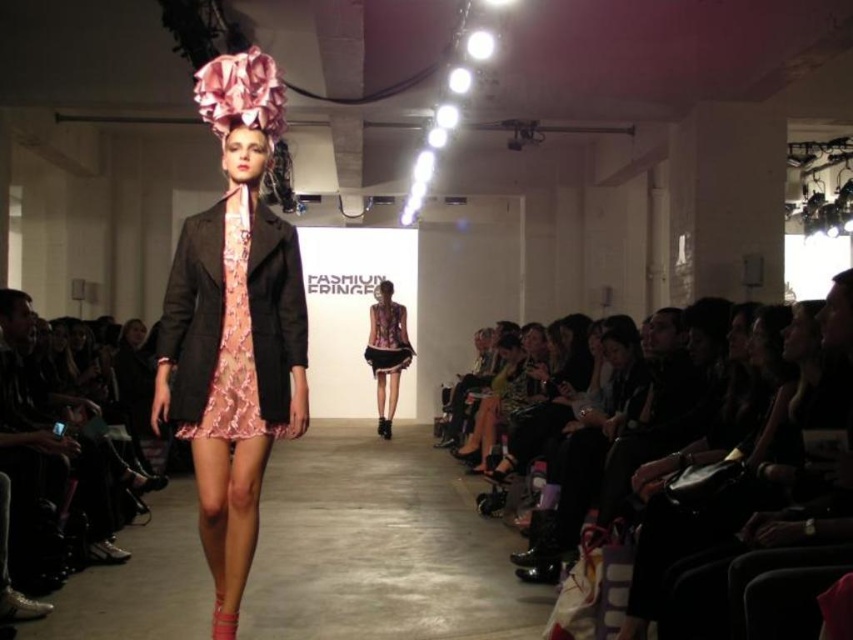
Does metallic sequined dress at center appear over metallic pink dress at center?

Actually, metallic sequined dress at center is below metallic pink dress at center.

From the picture: Is metallic sequined dress at center to the left of metallic pink dress at center from the viewer's perspective?

Indeed, metallic sequined dress at center is positioned on the left side of metallic pink dress at center.

Between point (404, 358) and point (375, 308), which one is positioned behind?

Point (375, 308)

This screenshot has height=640, width=853. Find the location of `metallic sequined dress at center`. metallic sequined dress at center is located at coordinates (387, 352).

Between black leather jacket at center and metallic sequined dress at center, which one has more height?

metallic sequined dress at center is taller.

Is black leather jacket at center behind metallic sequined dress at center?

That is False.

You are a GUI agent. You are given a task and a screenshot of the screen. Output one action in this format:
    pyautogui.click(x=<x>, y=<y>)
    Task: Click on the black leather jacket at center
    
    Given the screenshot: What is the action you would take?
    pyautogui.click(x=766, y=474)

Between point (200, 221) and point (370, 316), which one is positioned in front?

Positioned in front is point (200, 221).

Between point (219, 234) and point (398, 353), which one is positioned in front?

Point (219, 234) is in front.

Identify the location of pink satin dress at center. (233, 323).